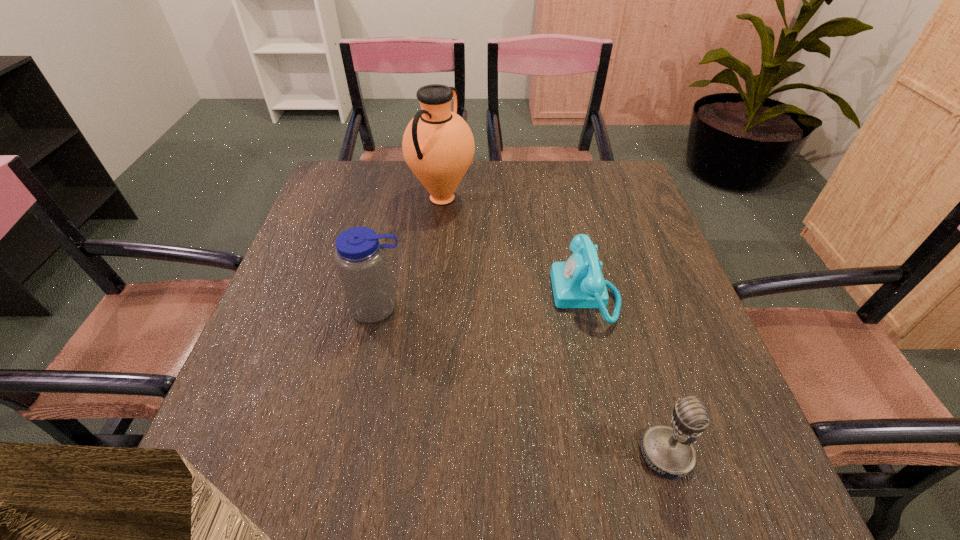
Find the location of `vacant region at the left edge of the desktop`. vacant region at the left edge of the desktop is located at coordinates (301, 401).

In order to click on free space at the right edge in this screenshot , I will do `click(654, 237)`.

You are a GUI agent. You are given a task and a screenshot of the screen. Output one action in this format:
    pyautogui.click(x=<x>, y=<y>)
    Task: Click on the free space at the near left corner of the desktop
    This screenshot has height=540, width=960.
    Given the screenshot: What is the action you would take?
    pyautogui.click(x=216, y=476)

Find the location of `vacant space at the near right corner`. vacant space at the near right corner is located at coordinates (733, 494).

Where is `free space between the nearest object and the water bottle`? free space between the nearest object and the water bottle is located at coordinates (522, 381).

The image size is (960, 540). In order to click on free spot between the farthest object and the telephone in this screenshot , I will do `click(514, 246)`.

Identify the location of free space between the second shortest object and the farthest object. Image resolution: width=960 pixels, height=540 pixels. (554, 326).

Locate an element on the screen. The image size is (960, 540). vacant area that lies between the second tallest object and the telephone is located at coordinates (482, 301).

Image resolution: width=960 pixels, height=540 pixels. In order to click on free area in between the pitcher and the third tallest object in this screenshot , I will do `click(554, 326)`.

Find the location of a particular element. free space between the shortest object and the tallest object is located at coordinates (514, 246).